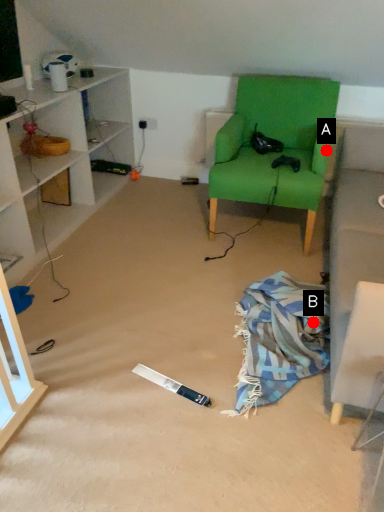
Question: Two points are circled on the image, labeled by A and B beside each circle. Which point is closer to the camera?

Choices:
 (A) A is closer
 (B) B is closer

Answer: (B)